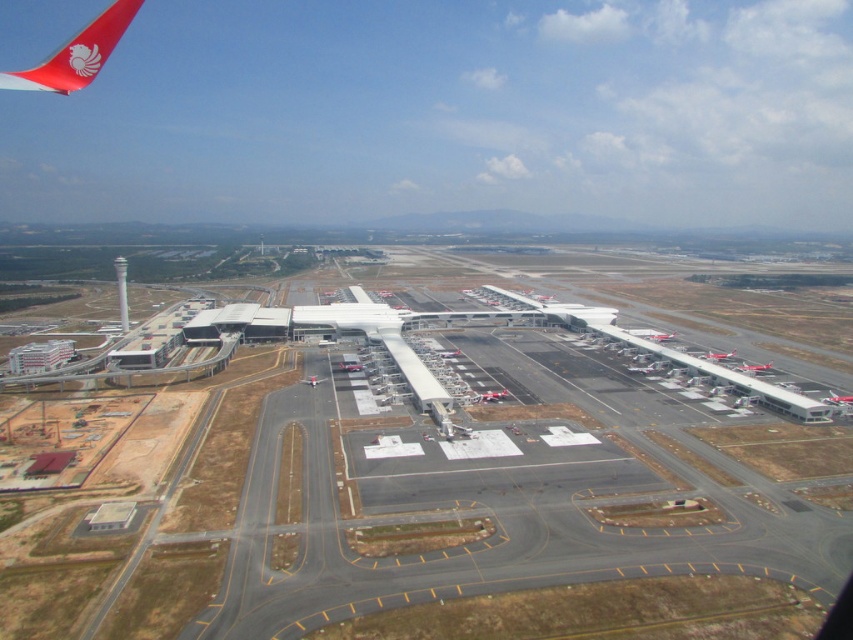
Is metallic silver airplane at center-right further to camera compared to matte white airplane at center?

No, metallic silver airplane at center-right is in front of matte white airplane at center.

Describe the element at coordinates (753, 369) in the screenshot. I see `metallic silver airplane at center-right` at that location.

Find the location of `metallic silver airplane at center-right`. metallic silver airplane at center-right is located at coordinates 753,369.

Can you confirm if gray concrete tarmac at center is positioned to the right of matte white airplane at center?

No, gray concrete tarmac at center is not to the right of matte white airplane at center.

Is gray concrete tarmac at center to the left of matte white airplane at center from the viewer's perspective?

Indeed, gray concrete tarmac at center is positioned on the left side of matte white airplane at center.

This screenshot has width=853, height=640. I want to click on gray concrete tarmac at center, so click(x=405, y=486).

Is metallic silver airplane at center bigger than matte white airplane at center?

Incorrect, metallic silver airplane at center is not larger than matte white airplane at center.

Does metallic silver airplane at center have a smaller size compared to matte white airplane at center?

Yes.

At what (x,y) coordinates should I click in order to perform the action: click on metallic silver airplane at center. Please return your answer as a coordinate pair (x, y). The image size is (853, 640). Looking at the image, I should click on (837, 400).